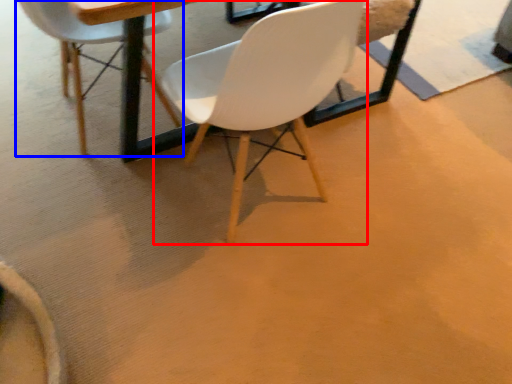
Question: Which of the following is the closest to the observer, chair (highlighted by a red box) or chair (highlighted by a blue box)?

Choices:
 (A) chair
 (B) chair

Answer: (A)